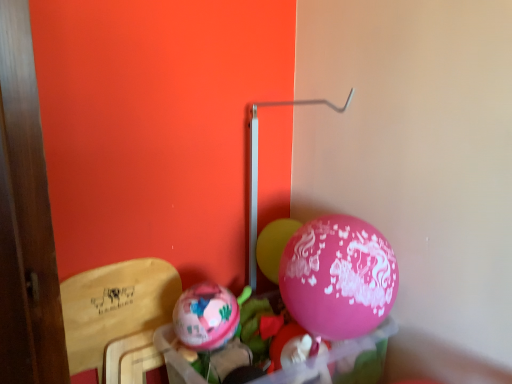
Question: Does pink glossy balloon at center, acting as the 2th balloon starting from the left, have a greater width compared to wooden armchair at left?

Choices:
 (A) yes
 (B) no

Answer: (B)

Question: Is pink glossy balloon at center, acting as the 2th balloon starting from the left, completely or partially outside of wooden armchair at left?

Choices:
 (A) no
 (B) yes

Answer: (B)

Question: Is pink glossy balloon at center, which appears as the first balloon when viewed from the back, looking in the opposite direction of wooden armchair at left?

Choices:
 (A) no
 (B) yes

Answer: (A)

Question: From a real-world perspective, is pink glossy balloon at center, arranged as the first balloon when viewed from the right, positioned over wooden armchair at left based on gravity?

Choices:
 (A) no
 (B) yes

Answer: (B)

Question: From the image's perspective, does pink glossy balloon at center, acting as the 2th balloon starting from the left, appear lower than wooden armchair at left?

Choices:
 (A) no
 (B) yes

Answer: (A)

Question: Can you confirm if pink glossy balloon at center, which is counted as the second balloon, starting from the front, is thinner than wooden armchair at left?

Choices:
 (A) yes
 (B) no

Answer: (A)

Question: Is wooden armchair at left to the left of pink glossy balloon at center, arranged as the first balloon when viewed from the right, from the viewer's perspective?

Choices:
 (A) yes
 (B) no

Answer: (A)

Question: Is wooden armchair at left far away from pink glossy balloon at center, acting as the 2th balloon starting from the left?

Choices:
 (A) no
 (B) yes

Answer: (A)

Question: From the image's perspective, does wooden armchair at left appear higher than pink glossy balloon at center, which appears as the first balloon when viewed from the back?

Choices:
 (A) yes
 (B) no

Answer: (B)

Question: Is wooden armchair at left closer to the viewer compared to pink glossy balloon at center, acting as the 2th balloon starting from the left?

Choices:
 (A) yes
 (B) no

Answer: (A)

Question: Considering the relative positions of wooden armchair at left and pink glossy balloon at center, which is counted as the second balloon, starting from the front, in the image provided, is wooden armchair at left to the right of pink glossy balloon at center, which is counted as the second balloon, starting from the front, from the viewer's perspective?

Choices:
 (A) yes
 (B) no

Answer: (B)

Question: Can you confirm if wooden armchair at left is bigger than pink glossy balloon at center, which is counted as the second balloon, starting from the front?

Choices:
 (A) no
 (B) yes

Answer: (B)

Question: Is matte pink balloon at center, which ranks as the 1th balloon in front-to-back order, not close to wooden armchair at left?

Choices:
 (A) yes
 (B) no

Answer: (B)